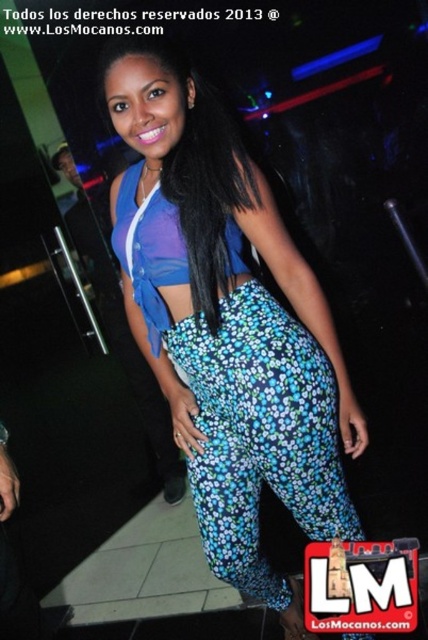
Looking at this image, does floral printed pants at center appear under floral print pants at center?

Incorrect, floral printed pants at center is not positioned below floral print pants at center.

Based on the photo, does floral printed pants at center have a lesser width compared to floral print pants at center?

No.

Who is more distant from viewer, (318, 316) or (329, 531)?

The point (329, 531) is behind.

Find the location of a particular element. The image size is (428, 640). floral printed pants at center is located at coordinates (226, 323).

Is floral printed pants at center wider than black silky hair at center?

Correct, the width of floral printed pants at center exceeds that of black silky hair at center.

Who is more distant from viewer, (228, 188) or (225, 163)?

Point (225, 163)

Is point (202, 340) closer to viewer compared to point (229, 140)?

No, it is behind (229, 140).

You are a GUI agent. You are given a task and a screenshot of the screen. Output one action in this format:
    pyautogui.click(x=<x>, y=<y>)
    Task: Click on the floral printed pants at center
    Image resolution: width=428 pixels, height=640 pixels.
    Given the screenshot: What is the action you would take?
    pyautogui.click(x=226, y=323)

From the picture: Is floral print pants at center taller than black silky hair at center?

Yes.

Which of these two, floral print pants at center or black silky hair at center, stands taller?

Standing taller between the two is floral print pants at center.

The height and width of the screenshot is (640, 428). Find the location of `floral print pants at center`. floral print pants at center is located at coordinates (261, 435).